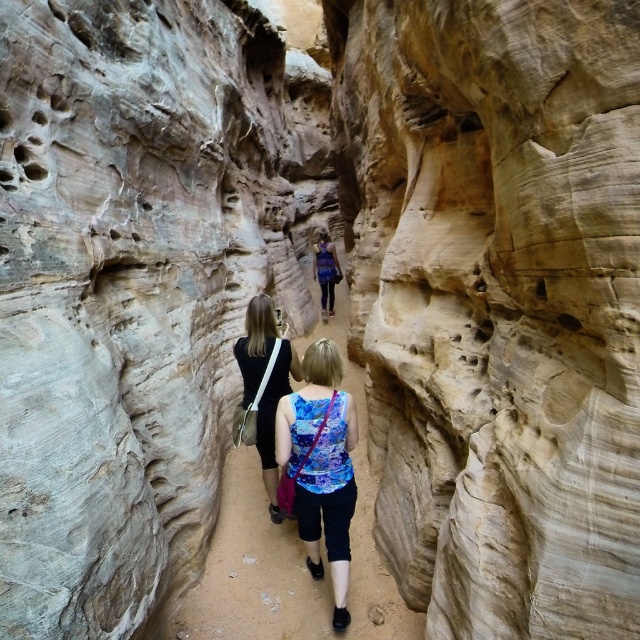
Question: Considering the real-world distances, which object is closest to the smooth beige rock at center?

Choices:
 (A) smooth sandstone trail at center
 (B) floral tank top at center
 (C) matte black dress at center
 (D) floral fabric tank top at center

Answer: (A)

Question: Is smooth sandstone trail at center positioned in front of floral fabric tank top at center?

Choices:
 (A) yes
 (B) no

Answer: (B)

Question: Which point is closer to the camera?

Choices:
 (A) floral tank top at center
 (B) smooth beige rock at center
 (C) floral fabric tank top at center
 (D) smooth sandstone trail at center

Answer: (B)

Question: Among these points, which one is farthest from the camera?

Choices:
 (A) (244, 362)
 (B) (312, 506)
 (C) (484, 525)
 (D) (328, 246)

Answer: (D)

Question: Is smooth sandstone trail at center wider than floral fabric tank top at center?

Choices:
 (A) no
 (B) yes

Answer: (B)

Question: Does matte black dress at center appear on the left side of floral tank top at center?

Choices:
 (A) no
 (B) yes

Answer: (B)